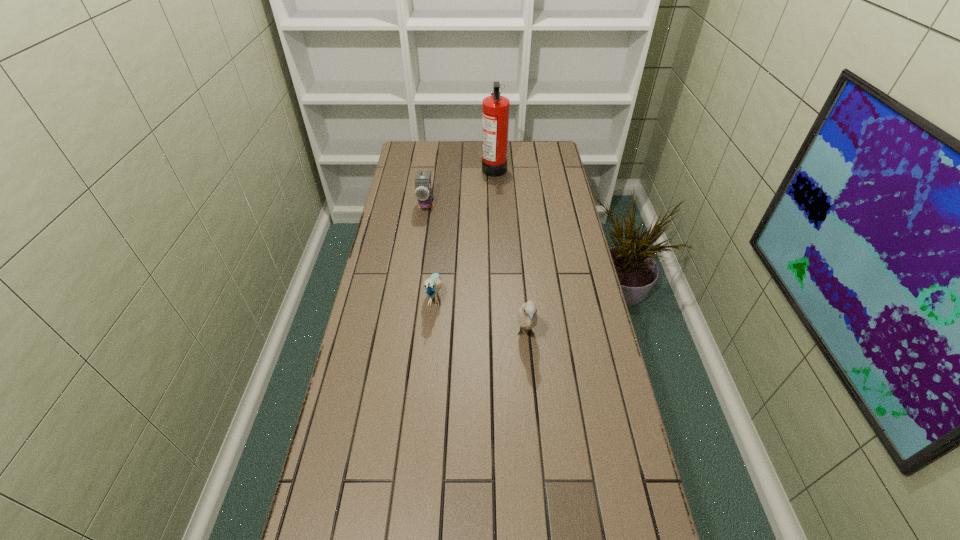
The height and width of the screenshot is (540, 960). I want to click on vacant space that's between the farthest bird and the rightmost bird, so click(x=476, y=269).

Find the location of a particular element. This screenshot has width=960, height=540. unoccupied area between the rightmost bird and the second object from left to right is located at coordinates (480, 315).

The height and width of the screenshot is (540, 960). I want to click on free spot between the farthest object and the second farthest object, so click(460, 186).

Locate an element on the screen. This screenshot has width=960, height=540. the closest object to the rightmost bird is located at coordinates (432, 285).

Where is `object identified as the second closest to the leftmost object`? object identified as the second closest to the leftmost object is located at coordinates (432, 285).

Locate which bird ranks third in proximity to the tallest object. Please provide its 2D coordinates. Your answer should be formatted as a tuple, i.e. [(x, y)], where the tuple contains the x and y coordinates of a point satisfying the conditions above.

[(527, 315)]

The image size is (960, 540). Find the location of `bird that is the closest to the fire extinguisher`. bird that is the closest to the fire extinguisher is located at coordinates (423, 194).

Where is `vacant position in the image that satisfies the following two spatial constraints: 1. on the front-facing side of the farthest object; 2. at the face of the second bird from right to left`? The image size is (960, 540). vacant position in the image that satisfies the following two spatial constraints: 1. on the front-facing side of the farthest object; 2. at the face of the second bird from right to left is located at coordinates (500, 296).

This screenshot has width=960, height=540. Find the location of `vacant region that satisfies the following two spatial constraints: 1. on the front-facing side of the tallest object; 2. at the face of the third object from right to left`. vacant region that satisfies the following two spatial constraints: 1. on the front-facing side of the tallest object; 2. at the face of the third object from right to left is located at coordinates (500, 296).

Identify the location of blank area in the image that satisfies the following two spatial constraints: 1. on the front-facing side of the fire extinguisher; 2. at the face of the second bird from left to right. The width and height of the screenshot is (960, 540). pyautogui.click(x=500, y=296).